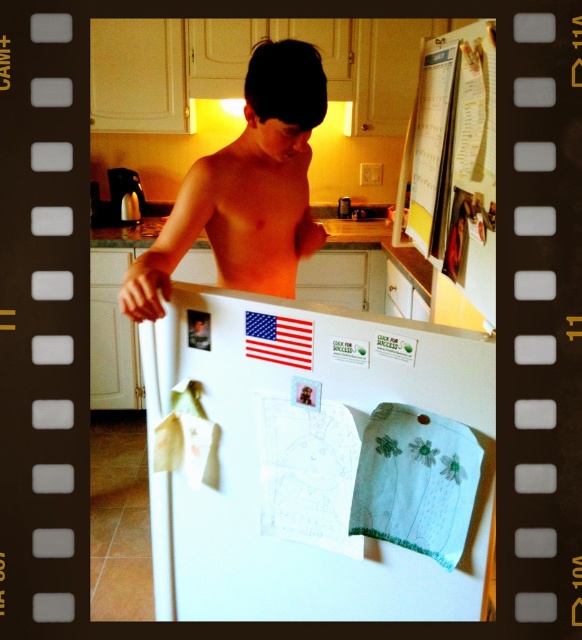
You are standing in the kitchen and want to place a small sticker on the refrigerator. You have two options for placement based on coordinates given in the image. The first option is at point [182,241] and the second is at point [219,259]. If you want the sticker to be closer to you, which point should you choose?

Point [182,241] is closer to the viewer than point [219,259], so you should choose the first option at point [182,241] to place the sticker closer to you.

You are a delivery person trying to place a package on the kitchen counter. The package is 12 inches wide. The white matte refrigerator at center and the pinkish flesh muscle at center are in your way. Can you fit the package between them?

The distance between the white matte refrigerator at center and the pinkish flesh muscle at center is 28.23 inches. Since the package is only 12 inches wide, there is enough space to fit it between them.

You are a delivery person who needs to deliver a package to the kitchen. The package is too large to fit through the doorway. The doorway is the same height as the shiny skin at center. Can the package fit through the doorway if it is the same height as the white matte refrigerator at center?

The white matte refrigerator at center is shorter than shiny skin at center. Since the doorway is the same height as the shiny skin at center, and the package is the same height as the white matte refrigerator at center, the package can fit through the doorway because it is shorter than the doorway height.